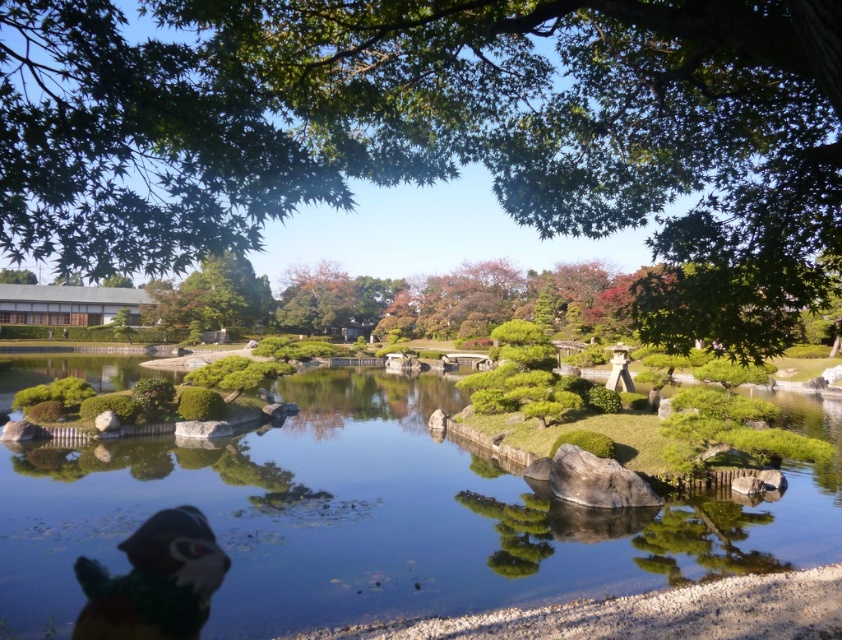
Question: Is green leafy tree at upper center to the right of multicolored plush toy at lower left from the viewer's perspective?

Choices:
 (A) yes
 (B) no

Answer: (A)

Question: Estimate the real-world distances between objects in this image. Which object is closer to the clear water at pond center?

Choices:
 (A) multicolored plush toy at lower left
 (B) green leafy tree at upper center

Answer: (A)

Question: Among these points, which one is farthest from the camera?

Choices:
 (A) (505, 588)
 (B) (195, 573)
 (C) (743, 234)

Answer: (A)

Question: Which point is closer to the camera?

Choices:
 (A) (147, 589)
 (B) (369, 388)

Answer: (A)

Question: Is the position of green leafy tree at upper center less distant than that of multicolored plush toy at lower left?

Choices:
 (A) no
 (B) yes

Answer: (B)

Question: Does green leafy tree at upper center have a larger size compared to multicolored plush toy at lower left?

Choices:
 (A) no
 (B) yes

Answer: (B)